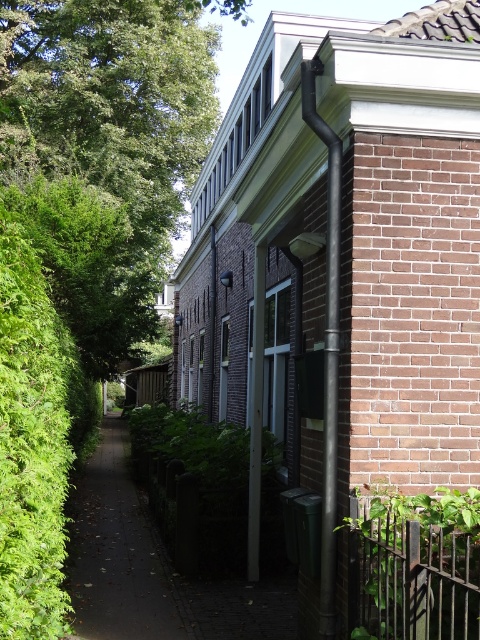
Who is higher up, dark brown paved path at center or black metal fence at lower right?

black metal fence at lower right is above.

Who is positioned more to the left, dark brown paved path at center or black metal fence at lower right?

dark brown paved path at center

The height and width of the screenshot is (640, 480). I want to click on dark brown paved path at center, so click(119, 554).

Between black metal fence at lower right and black matte pipe at upper right, which one appears on the left side from the viewer's perspective?

From the viewer's perspective, black matte pipe at upper right appears more on the left side.

Between black metal fence at lower right and black matte pipe at upper right, which one appears on the right side from the viewer's perspective?

black metal fence at lower right

The width and height of the screenshot is (480, 640). Identify the location of black metal fence at lower right. (409, 579).

Where is `black metal fence at lower right`? This screenshot has width=480, height=640. black metal fence at lower right is located at coordinates (409, 579).

Is dark brown paved path at center closer to the viewer compared to black matte pipe at upper right?

No, it is behind black matte pipe at upper right.

This screenshot has height=640, width=480. What do you see at coordinates (119, 554) in the screenshot?
I see `dark brown paved path at center` at bounding box center [119, 554].

Measure the distance between point [118,476] and camera.

They are 17.01 meters apart.

In order to click on dark brown paved path at center in this screenshot , I will do `click(119, 554)`.